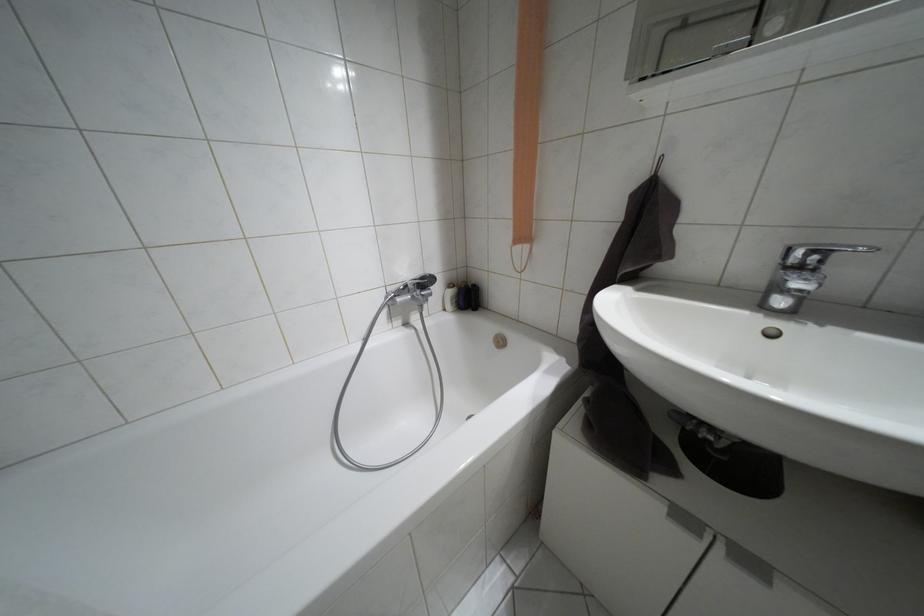
Identify the location of dark bottle. (475, 296).